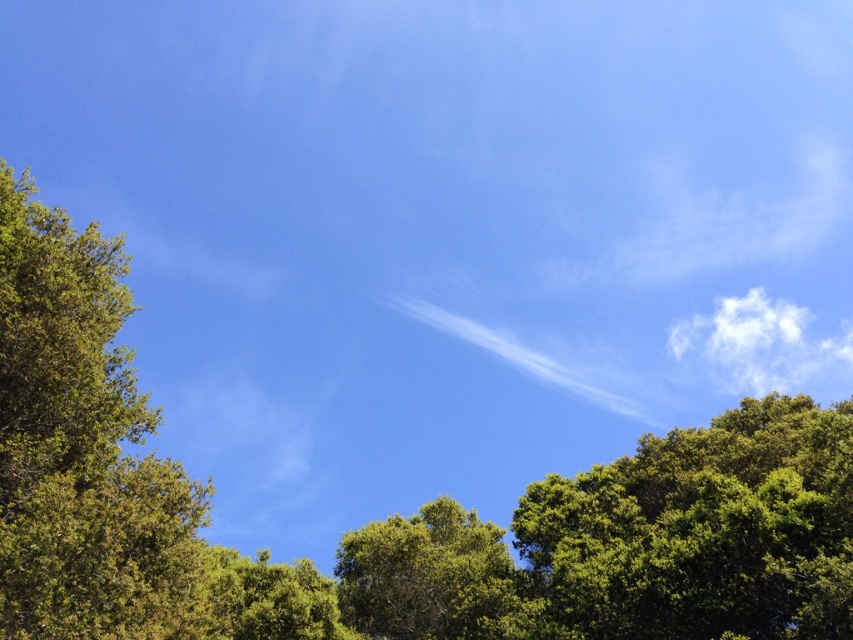
Which is in front, point (73, 435) or point (216, 570)?

Point (73, 435)

Is point (12, 634) closer to viewer compared to point (244, 593)?

Yes, point (12, 634) is closer to viewer.

At what (x,y) coordinates should I click in order to perform the action: click on green leafy tree at left. Please return your answer as a coordinate pair (x, y). The width and height of the screenshot is (853, 640). Looking at the image, I should click on (80, 445).

Find the location of a particular element. This screenshot has height=640, width=853. green leafy tree at left is located at coordinates (80, 445).

Can you confirm if green leafy tree at upper right is positioned to the left of green leafy tree at lower center?

Incorrect, green leafy tree at upper right is not on the left side of green leafy tree at lower center.

Does green leafy tree at upper right have a lesser width compared to green leafy tree at lower center?

No.

Which is behind, point (769, 592) or point (241, 586)?

The point (241, 586) is more distant.

You are a GUI agent. You are given a task and a screenshot of the screen. Output one action in this format:
    pyautogui.click(x=<x>, y=<y>)
    Task: Click on the green leafy tree at upper right
    This screenshot has width=853, height=640.
    Given the screenshot: What is the action you would take?
    tap(701, 531)

Who is taller, green leafy tree at upper right or green leafy tree at center?

green leafy tree at upper right is taller.

Does point (659, 620) come farther from viewer compared to point (401, 529)?

No.

Identify the location of green leafy tree at upper right. The height and width of the screenshot is (640, 853). (701, 531).